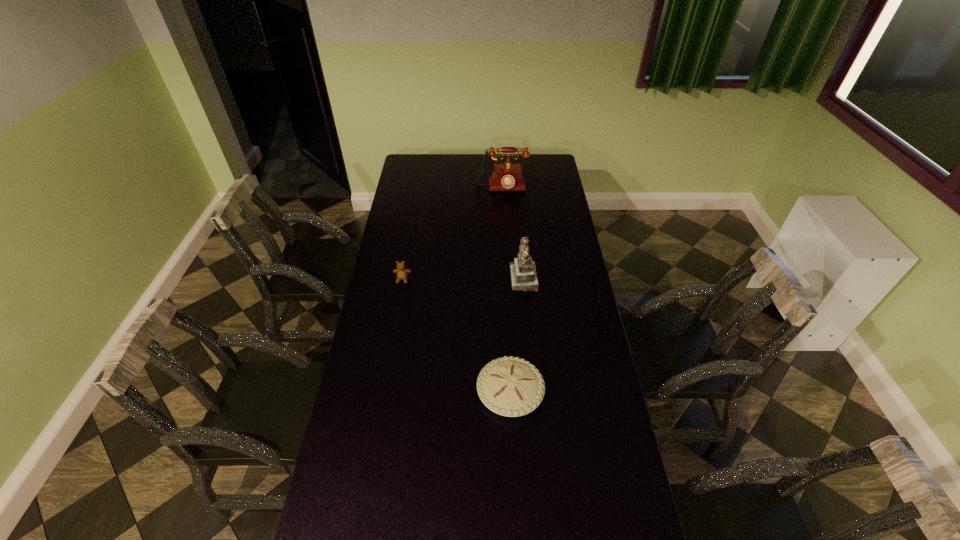
You are a GUI agent. You are given a task and a screenshot of the screen. Output one action in this format:
    pyautogui.click(x=<x>, y=<y>)
    Task: Click on the telephone
    
    Given the screenshot: What is the action you would take?
    pyautogui.click(x=506, y=177)

This screenshot has height=540, width=960. I want to click on figurine, so click(x=523, y=271).

Image resolution: width=960 pixels, height=540 pixels. Find the location of `teddy bear`. teddy bear is located at coordinates (401, 272).

Locate an element on the screen. the nearest object is located at coordinates (510, 386).

The width and height of the screenshot is (960, 540). In order to click on the shortest object in this screenshot , I will do `click(510, 386)`.

This screenshot has width=960, height=540. I want to click on vacant area located 0.310m on the dial of the farthest object, so click(x=504, y=233).

The image size is (960, 540). I want to click on free location located 0.050m on the front-facing side of the figurine, so click(499, 279).

You are a GUI agent. You are given a task and a screenshot of the screen. Output one action in this format:
    pyautogui.click(x=<x>, y=<y>)
    Task: Click on the blank space located on the front-facing side of the figurine
    Image resolution: width=960 pixels, height=540 pixels.
    Given the screenshot: What is the action you would take?
    pyautogui.click(x=460, y=279)

Find the location of a particular element. vacant position located 0.270m on the front-facing side of the figurine is located at coordinates (448, 279).

At what (x,y) coordinates should I click in order to perform the action: click on vacant space located 0.230m on the front-facing side of the leftmost object. Please return your answer as a coordinate pair (x, y). This screenshot has width=960, height=540. Looking at the image, I should click on (395, 326).